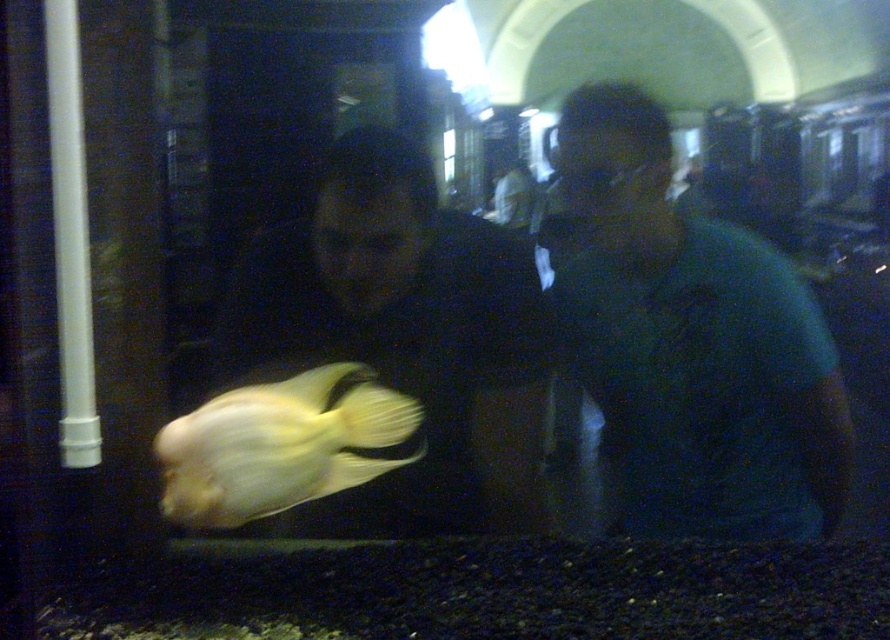
Question: Observing the image, what is the correct spatial positioning of green matte shirt at center in reference to smooth yellow fish at left?

Choices:
 (A) right
 (B) left

Answer: (A)

Question: Can you confirm if green matte shirt at center is bigger than smooth yellow fish at left?

Choices:
 (A) no
 (B) yes

Answer: (A)

Question: Which object is positioned closest to the green matte shirt at center?

Choices:
 (A) translucent yellow fish at center
 (B) smooth yellow fish at left

Answer: (B)

Question: Can you confirm if green matte shirt at center is thinner than smooth yellow fish at left?

Choices:
 (A) yes
 (B) no

Answer: (A)

Question: Which object is closer to the camera taking this photo?

Choices:
 (A) smooth yellow fish at left
 (B) translucent yellow fish at center
 (C) green matte shirt at center

Answer: (B)

Question: Which object appears closest to the camera in this image?

Choices:
 (A) translucent yellow fish at center
 (B) smooth yellow fish at left

Answer: (A)